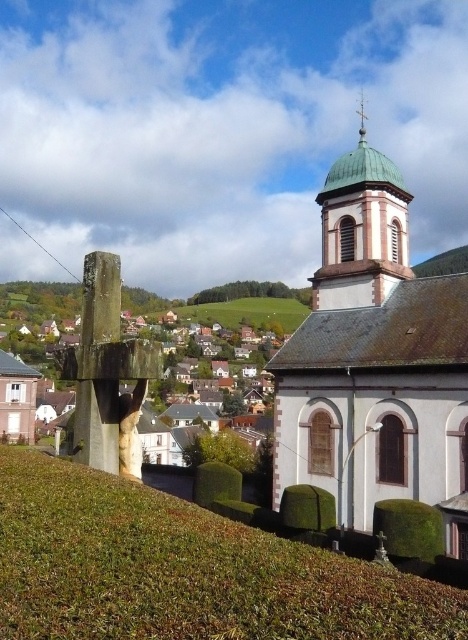
Can you confirm if green copper dome at upper right is positioned to the right of green copper dome at upper center?

In fact, green copper dome at upper right is to the left of green copper dome at upper center.

Between green copper dome at upper right and green copper dome at upper center, which one is positioned lower?

green copper dome at upper right

Find the location of `green copper dome at upper right`. green copper dome at upper right is located at coordinates (374, 362).

Describe the element at coordinates (374, 362) in the screenshot. Image resolution: width=468 pixels, height=640 pixels. I see `green copper dome at upper right` at that location.

Who is lower down, green copper dome at upper right or green copper spire at upper center?

Positioned lower is green copper dome at upper right.

Which is behind, point (337, 259) or point (359, 115)?

Point (359, 115)

Where is `green copper dome at upper right`? green copper dome at upper right is located at coordinates (374, 362).

Who is higher up, green copper dome at upper center or green copper spire at upper center?

green copper spire at upper center is above.

Can you confirm if green copper dome at upper center is positioned above green copper spire at upper center?

No, green copper dome at upper center is not above green copper spire at upper center.

Which is behind, point (388, 198) or point (362, 108)?

Positioned behind is point (362, 108).

You are a GUI agent. You are given a task and a screenshot of the screen. Output one action in this format:
    pyautogui.click(x=<x>, y=<y>)
    Task: Click on the green copper dome at upper center
    
    Given the screenshot: What is the action you would take?
    pyautogui.click(x=362, y=230)